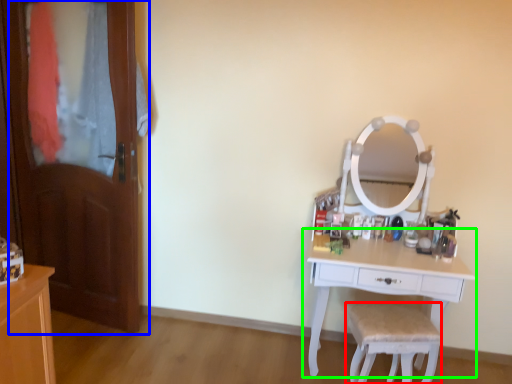
Question: Which object is positioned closest to chair (highlighted by a red box)? Select from door (highlighted by a blue box) and table (highlighted by a green box).

Choices:
 (A) door
 (B) table

Answer: (B)